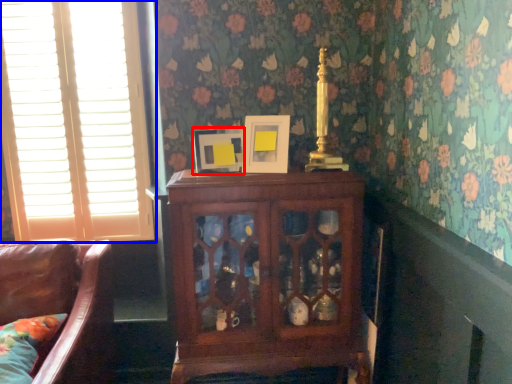
Question: Which object appears farthest to the camera in this image, picture frame (highlighted by a red box) or window (highlighted by a blue box)?

Choices:
 (A) picture frame
 (B) window

Answer: (B)